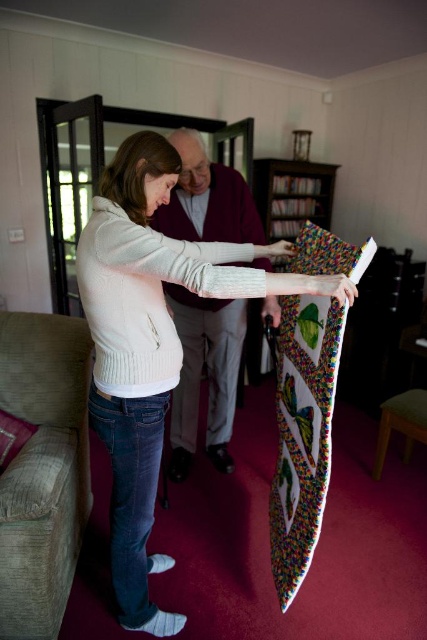
You are a tailor measuring the distance between two sweaters in the image. The white knit sweater at center and the maroon sweater at center are part of a display. Can you fit a 24 inch wide box between them?

The distance between the white knit sweater at center and the maroon sweater at center is 25.37 inches, which is wider than the 24 inch box. Therefore, the box can fit between them.

You are an observer standing in front of the scene. You see both the white knit sweater at center and the maroon sweater at center. Which sweater is nearer to you?

The white knit sweater at center is closer to the viewer than the maroon sweater at center.

What is the spatial relationship between the white knit sweater at center and the other objects in the scene?

The white knit sweater at center is positioned at coordinates point (152, 342), which places it centrally in the image, likely between the two individuals described in the scene.